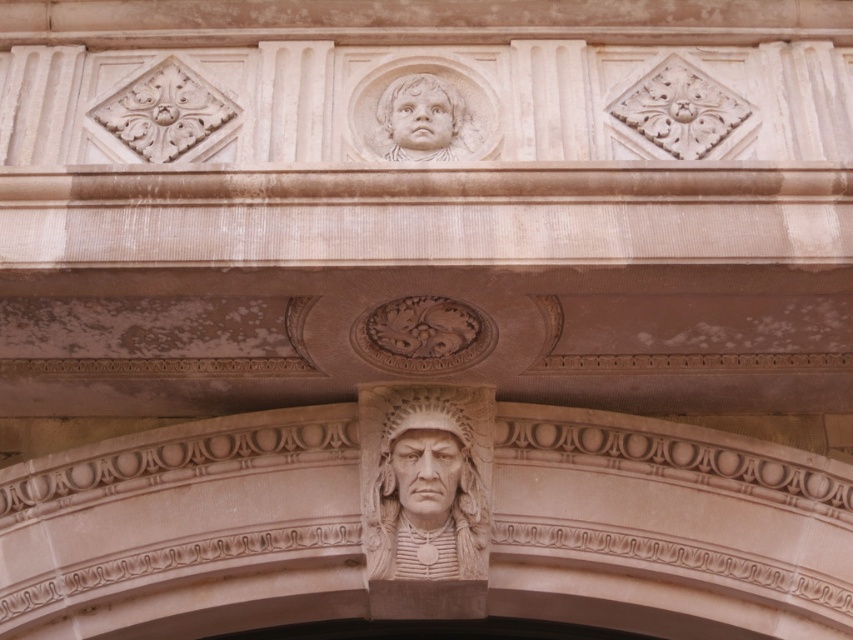
Question: Can you confirm if carved stone indian head at center is wider than matte stone face at center?

Choices:
 (A) yes
 (B) no

Answer: (A)

Question: Can you confirm if matte stone face at center is wider than smooth stone face at upper center?

Choices:
 (A) yes
 (B) no

Answer: (A)

Question: Which object is farther from the camera taking this photo?

Choices:
 (A) smooth beige stone head at upper center
 (B) smooth stone face at upper center
 (C) matte stone face at center

Answer: (C)

Question: Observing the image, what is the correct spatial positioning of carved stone indian head at center in reference to smooth stone face at upper center?

Choices:
 (A) right
 (B) left

Answer: (B)

Question: Which point is farther from the camera taking this photo?

Choices:
 (A) (387, 548)
 (B) (444, 131)

Answer: (A)

Question: Which of the following is the closest to the observer?

Choices:
 (A) (450, 102)
 (B) (393, 97)
 (C) (375, 452)

Answer: (A)